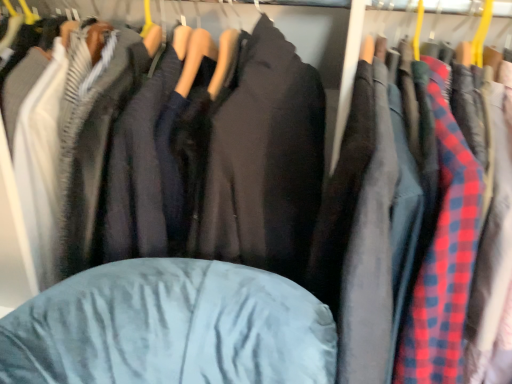
Question: From the image's perspective, is velvet blue bean bag at center positioned above or below velvet blue jacket at center?

Choices:
 (A) below
 (B) above

Answer: (A)

Question: In terms of width, does velvet blue bean bag at center look wider or thinner when compared to velvet blue jacket at center?

Choices:
 (A) thin
 (B) wide

Answer: (A)

Question: Estimate the real-world distances between objects in this image. Which object is closer to the red plaid shirt at center?

Choices:
 (A) velvet blue jacket at center
 (B) velvet blue bean bag at center

Answer: (B)

Question: Estimate the real-world distances between objects in this image. Which object is farther from the red plaid shirt at center?

Choices:
 (A) velvet blue bean bag at center
 (B) velvet blue jacket at center

Answer: (B)